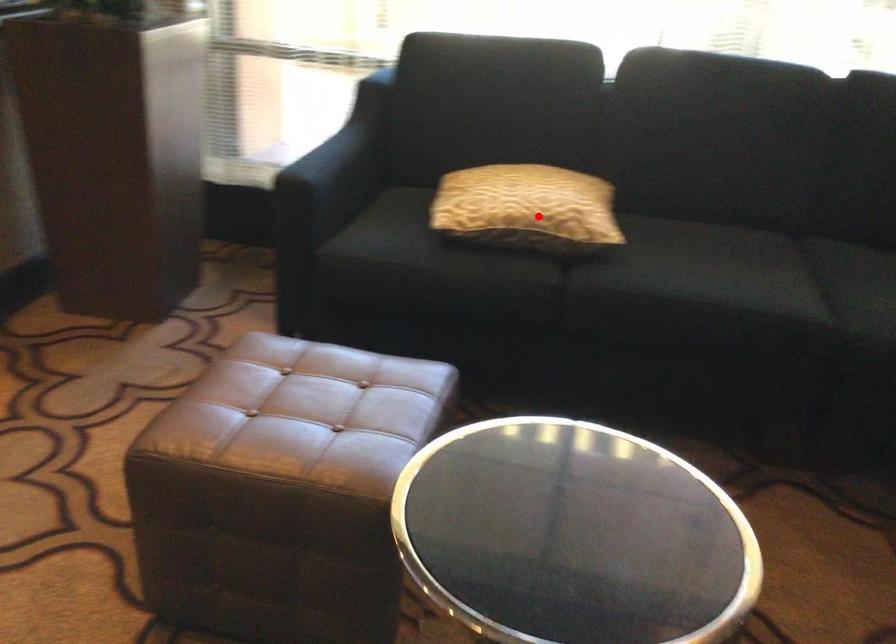
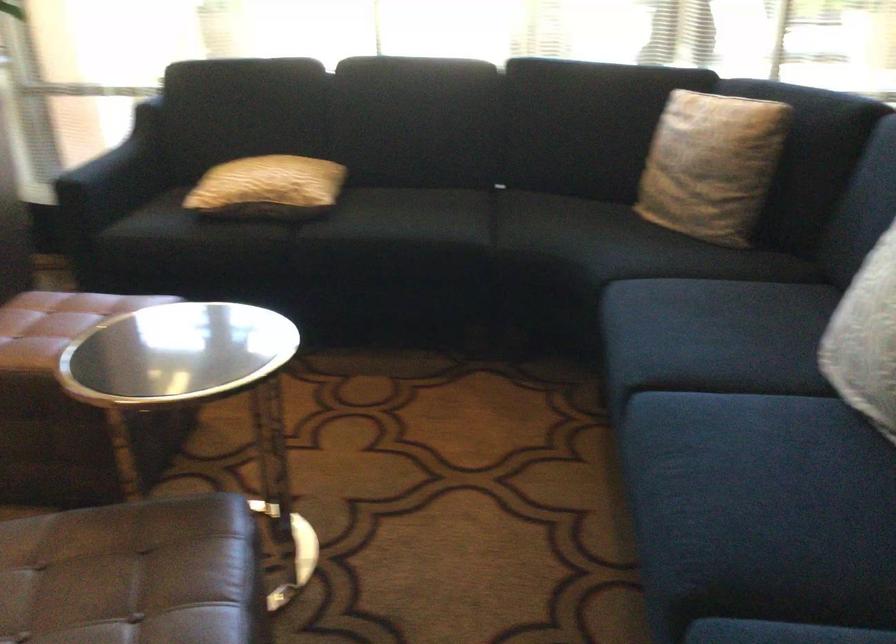
Where in the second image is the point corresponding to the highlighted location from the first image?

(268, 187)